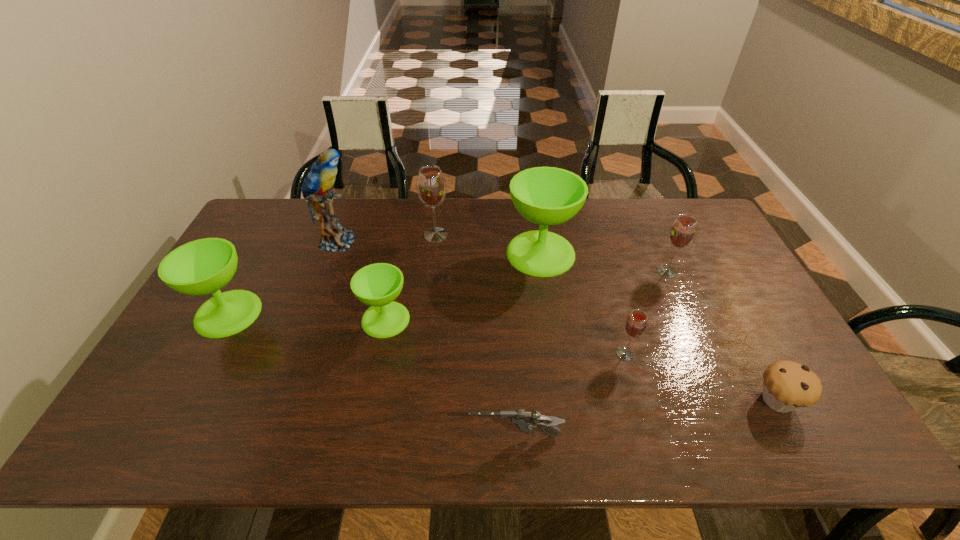
Image resolution: width=960 pixels, height=540 pixels. I want to click on the closest wineglass to the second object from left to right, so click(x=204, y=266).

Locate which wineglass ranks fifth in proximity to the parrot. Please provide its 2D coordinates. Your answer should be formatted as a tuple, i.e. [(x, y)], where the tuple contains the x and y coordinates of a point satisfying the conditions above.

[(635, 326)]

Point out which green wineglass is positioned as the nearest to the eighth object from left to right. Please provide its 2D coordinates. Your answer should be formatted as a tuple, i.e. [(x, y)], where the tuple contains the x and y coordinates of a point satisfying the conditions above.

[(547, 196)]

This screenshot has height=540, width=960. In order to click on green wineglass that can be found as the closest to the gun in this screenshot , I will do `click(377, 285)`.

Locate which red wineglass is the closest to the biggest green wineglass. Please provide its 2D coordinates. Your answer should be formatted as a tuple, i.e. [(x, y)], where the tuple contains the x and y coordinates of a point satisfying the conditions above.

[(431, 186)]

Locate an element on the screen. red wineglass object that ranks as the second closest to the nearest object is located at coordinates (682, 232).

Where is `vacant space that satisfies the following two spatial constraints: 1. on the face of the smallest green wineglass; 2. on the left side of the parrot`? vacant space that satisfies the following two spatial constraints: 1. on the face of the smallest green wineglass; 2. on the left side of the parrot is located at coordinates (308, 319).

Find the location of `vacant space that satisfies the following two spatial constraints: 1. on the face of the muffin; 2. on the right side of the parrot`. vacant space that satisfies the following two spatial constraints: 1. on the face of the muffin; 2. on the right side of the parrot is located at coordinates (278, 400).